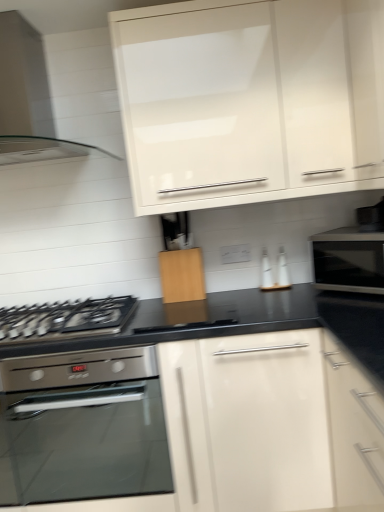
Question: Should I look upward or downward to see clear glass range hood at upper left?

Choices:
 (A) down
 (B) up

Answer: (B)

Question: Is white glossy cabinet at upper center, which is the second cabinetry from bottom to top, at the left side of clear glass range hood at upper left?

Choices:
 (A) yes
 (B) no

Answer: (B)

Question: Does white glossy cabinet at upper center, which is the second cabinetry from bottom to top, have a larger size compared to clear glass range hood at upper left?

Choices:
 (A) no
 (B) yes

Answer: (B)

Question: Is white glossy cabinet at upper center, arranged as the first cabinetry when viewed from the top, at the right side of clear glass range hood at upper left?

Choices:
 (A) no
 (B) yes

Answer: (B)

Question: Can clear glass range hood at upper left be found inside white glossy cabinet at upper center, which is the second cabinetry from bottom to top?

Choices:
 (A) yes
 (B) no

Answer: (B)

Question: Is white glossy cabinet at upper center, arranged as the first cabinetry when viewed from the top, outside of clear glass range hood at upper left?

Choices:
 (A) no
 (B) yes

Answer: (B)

Question: Is white glossy cabinet at upper center, which is the second cabinetry from bottom to top, shorter than clear glass range hood at upper left?

Choices:
 (A) no
 (B) yes

Answer: (A)

Question: Does clear glass range hood at upper left have a lesser width compared to white glossy cabinet at upper center, which is the second cabinetry from bottom to top?

Choices:
 (A) yes
 (B) no

Answer: (B)

Question: Is clear glass range hood at upper left to the left of white glossy cabinet at upper center, which is the second cabinetry from bottom to top, from the viewer's perspective?

Choices:
 (A) yes
 (B) no

Answer: (A)

Question: Does clear glass range hood at upper left come behind white glossy cabinet at upper center, which is the second cabinetry from bottom to top?

Choices:
 (A) yes
 (B) no

Answer: (A)

Question: Considering the relative sizes of clear glass range hood at upper left and white glossy cabinet at upper center, which is the second cabinetry from bottom to top, in the image provided, is clear glass range hood at upper left wider than white glossy cabinet at upper center, which is the second cabinetry from bottom to top,?

Choices:
 (A) yes
 (B) no

Answer: (A)

Question: From the image's perspective, is clear glass range hood at upper left on white glossy cabinet at upper center, arranged as the first cabinetry when viewed from the top?

Choices:
 (A) yes
 (B) no

Answer: (A)

Question: Is clear glass range hood at upper left closer to the viewer compared to white glossy cabinet at upper center, arranged as the first cabinetry when viewed from the top?

Choices:
 (A) yes
 (B) no

Answer: (B)

Question: Can you confirm if wooden cutting board at center, which is the 1th cabinetry in bottom-to-top order, is smaller than clear glass range hood at upper left?

Choices:
 (A) no
 (B) yes

Answer: (B)